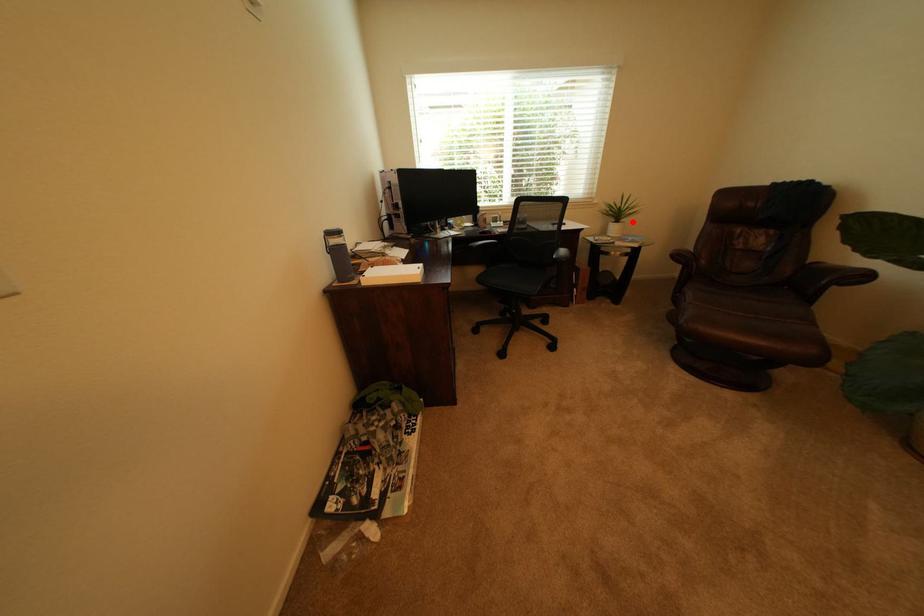
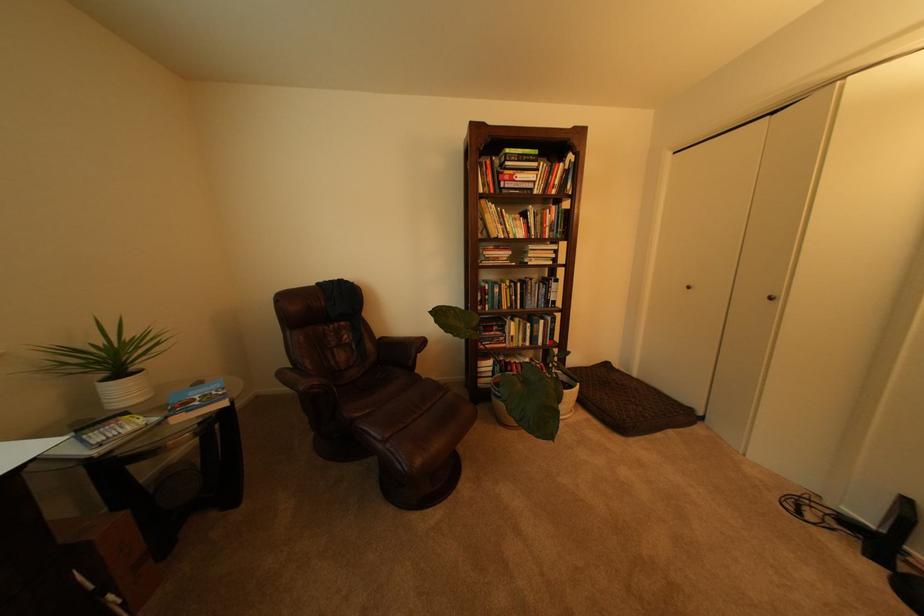
The point at the highlighted location is marked in the first image. Where is the corresponding point in the second image?

(143, 370)